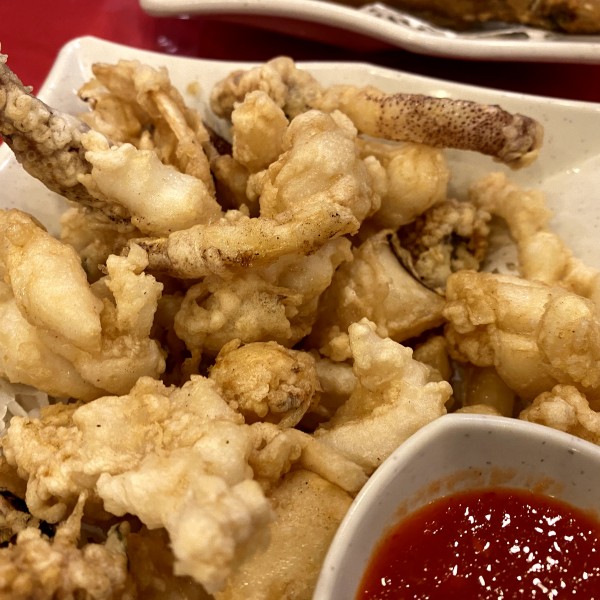
Locate an element on the screen. This screenshot has width=600, height=600. table is located at coordinates (117, 12).